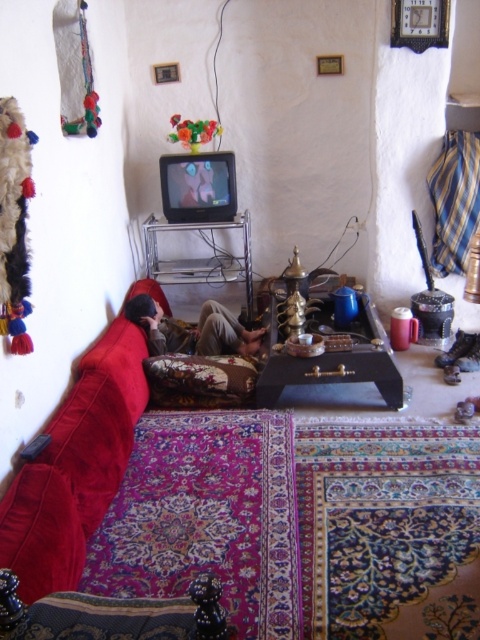
Is velvet red couch at lower left to the left of floral fabric pillow at center from the viewer's perspective?

Indeed, velvet red couch at lower left is positioned on the left side of floral fabric pillow at center.

Which is above, velvet red couch at lower left or floral fabric pillow at center?

floral fabric pillow at center is above.

Measure the distance between point (36,564) and camera.

Point (36,564) and camera are 5.29 feet apart from each other.

This screenshot has height=640, width=480. I want to click on velvet red couch at lower left, so click(x=75, y=467).

Between floral fabric pillow at center and matte brown person at center, which one is positioned higher?

matte brown person at center

Does point (165, 400) come closer to viewer compared to point (227, 310)?

Yes, it is.

At what (x,y) coordinates should I click in order to perform the action: click on floral fabric pillow at center. Please return your answer as a coordinate pair (x, y). Looking at the image, I should click on (200, 380).

Is velvet red couch at lower left to the left of matte brown person at center from the viewer's perspective?

Yes, velvet red couch at lower left is to the left of matte brown person at center.

Does velvet red couch at lower left have a larger size compared to matte brown person at center?

Yes.

Does point (46, 579) come behind point (169, 333)?

That is False.

Image resolution: width=480 pixels, height=640 pixels. Identify the location of velvet red couch at lower left. (75, 467).